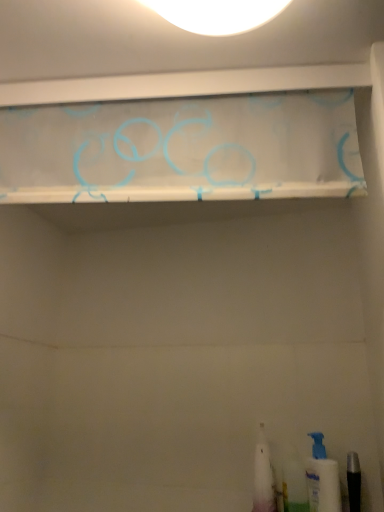
Question: From the image's perspective, would you say translucent plastic toothbrush at lower right, the second toiletry viewed from the right, is shown under translucent fabric curtain at upper center?

Choices:
 (A) no
 (B) yes

Answer: (B)

Question: From a real-world perspective, is translucent plastic toothbrush at lower right, the second toiletry viewed from the right, physically below translucent fabric curtain at upper center?

Choices:
 (A) yes
 (B) no

Answer: (A)

Question: From the image's perspective, is translucent plastic toothbrush at lower right, the second toiletry viewed from the right, located above translucent fabric curtain at upper center?

Choices:
 (A) yes
 (B) no

Answer: (B)

Question: Is translucent plastic toothbrush at lower right, the second toiletry viewed from the right, positioned before translucent fabric curtain at upper center?

Choices:
 (A) no
 (B) yes

Answer: (A)

Question: Considering the relative positions of translucent plastic toothbrush at lower right, the second toiletry viewed from the right, and translucent fabric curtain at upper center in the image provided, is translucent plastic toothbrush at lower right, the second toiletry viewed from the right, to the right of translucent fabric curtain at upper center from the viewer's perspective?

Choices:
 (A) yes
 (B) no

Answer: (A)

Question: Considering the relative positions of white plastic toothbrush at lower right, positioned as the 3th toiletry in right-to-left order, and translucent plastic toothbrush at lower right, the second toiletry viewed from the right, in the image provided, is white plastic toothbrush at lower right, positioned as the 3th toiletry in right-to-left order, to the left or to the right of translucent plastic toothbrush at lower right, the second toiletry viewed from the right,?

Choices:
 (A) left
 (B) right

Answer: (A)

Question: Considering the positions of white plastic toothbrush at lower right, the 1th toiletry in the left-to-right sequence, and translucent plastic toothbrush at lower right, the second toiletry in the left-to-right sequence, in the image, is white plastic toothbrush at lower right, the 1th toiletry in the left-to-right sequence, wider or thinner than translucent plastic toothbrush at lower right, the second toiletry in the left-to-right sequence,?

Choices:
 (A) thin
 (B) wide

Answer: (B)

Question: Considering the positions of point (263, 446) and point (284, 462), is point (263, 446) closer or farther from the camera than point (284, 462)?

Choices:
 (A) closer
 (B) farther

Answer: (B)

Question: In terms of height, does white plastic toothbrush at lower right, positioned as the 3th toiletry in right-to-left order, look taller or shorter compared to translucent plastic toothbrush at lower right, the second toiletry viewed from the right?

Choices:
 (A) tall
 (B) short

Answer: (A)

Question: Is white plastic pump bottle at lower right, the first toiletry when ordered from right to left, to the left or to the right of white plastic toothbrush at lower right, the 1th toiletry in the left-to-right sequence, in the image?

Choices:
 (A) left
 (B) right

Answer: (B)

Question: From the image's perspective, is white plastic pump bottle at lower right, the first toiletry when ordered from right to left, positioned above or below white plastic toothbrush at lower right, positioned as the 3th toiletry in right-to-left order?

Choices:
 (A) above
 (B) below

Answer: (A)

Question: In terms of width, does white plastic pump bottle at lower right, acting as the 3th toiletry starting from the left, look wider or thinner when compared to white plastic toothbrush at lower right, the 1th toiletry in the left-to-right sequence?

Choices:
 (A) wide
 (B) thin

Answer: (B)

Question: Considering the positions of white plastic pump bottle at lower right, the first toiletry when ordered from right to left, and white plastic toothbrush at lower right, positioned as the 3th toiletry in right-to-left order, in the image, is white plastic pump bottle at lower right, the first toiletry when ordered from right to left, taller or shorter than white plastic toothbrush at lower right, positioned as the 3th toiletry in right-to-left order,?

Choices:
 (A) tall
 (B) short

Answer: (B)

Question: Do you think white plastic toothbrush at lower right, positioned as the 3th toiletry in right-to-left order, is within translucent fabric curtain at upper center, or outside of it?

Choices:
 (A) inside
 (B) outside

Answer: (B)

Question: Does point pos(263,488) appear closer or farther from the camera than point pos(241,142)?

Choices:
 (A) closer
 (B) farther

Answer: (B)